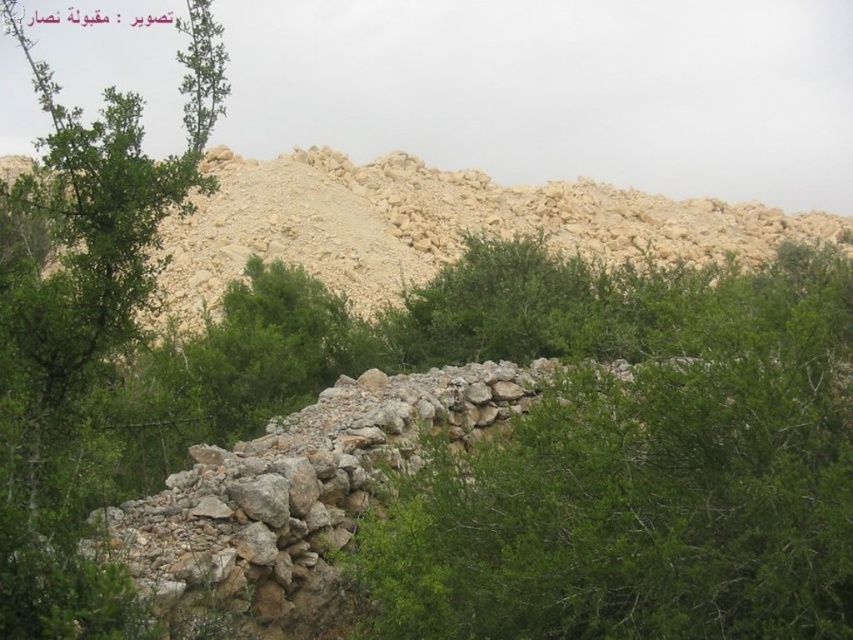
Question: In this image, where is green leafy shrub at center located relative to beige stone hillside at upper center?

Choices:
 (A) above
 (B) below

Answer: (B)

Question: Does green leafy shrub at center appear over green leafy tree at center?

Choices:
 (A) yes
 (B) no

Answer: (B)

Question: Considering the real-world distances, which object is farthest from the green leafy shrub at center?

Choices:
 (A) green leafy tree at center
 (B) beige stone hillside at upper center

Answer: (B)

Question: Is the position of green leafy tree at center more distant than that of beige stone hillside at upper center?

Choices:
 (A) no
 (B) yes

Answer: (A)

Question: Which of these objects is positioned closest to the green leafy shrub at center?

Choices:
 (A) beige stone hillside at upper center
 (B) green leafy tree at center

Answer: (B)

Question: Which point is farther to the camera?

Choices:
 (A) (532, 512)
 (B) (138, 141)

Answer: (B)